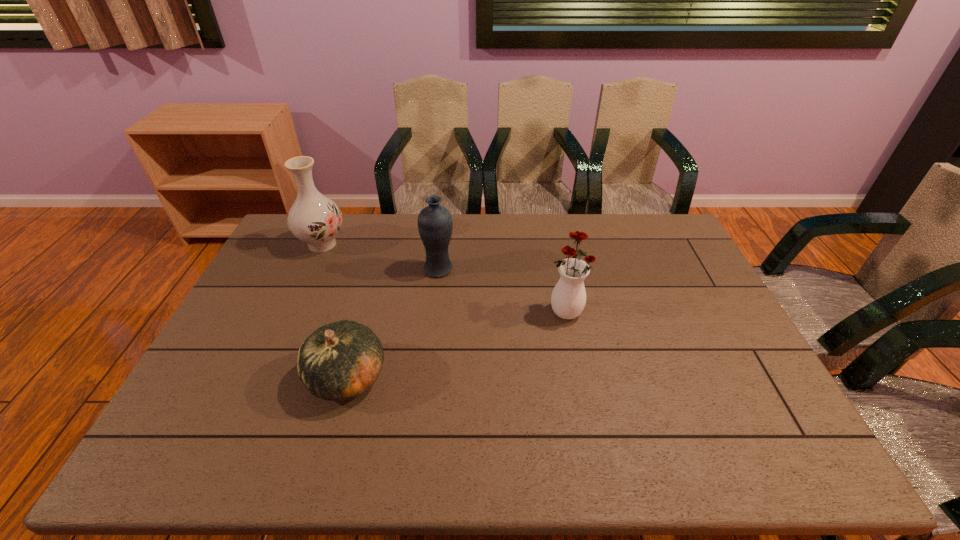
You are a GUI agent. You are given a task and a screenshot of the screen. Output one action in this format:
    pyautogui.click(x=<x>, y=<y>)
    Task: Click on the tallest object
    The image size is (960, 540).
    Given the screenshot: What is the action you would take?
    pyautogui.click(x=315, y=219)

Identify the location of the leftmost object. (315, 219).

Where is `the second object from right to left`? This screenshot has width=960, height=540. the second object from right to left is located at coordinates click(x=435, y=225).

The height and width of the screenshot is (540, 960). What are the coordinates of `the rightmost vase` in the screenshot? It's located at (568, 299).

Locate an element on the screen. Image resolution: width=960 pixels, height=540 pixels. the nearest vase is located at coordinates (568, 299).

Locate an element on the screen. the second object from left to right is located at coordinates (339, 361).

Image resolution: width=960 pixels, height=540 pixels. In order to click on gourd in this screenshot , I will do `click(339, 361)`.

The height and width of the screenshot is (540, 960). I want to click on vacant space situated 0.300m on the front of the tallest vase, so click(287, 323).

Locate an element on the screen. The image size is (960, 540). free location located on the left of the second vase from right to left is located at coordinates (408, 269).

Where is `free region located on the front of the second nearest object`? free region located on the front of the second nearest object is located at coordinates [574, 357].